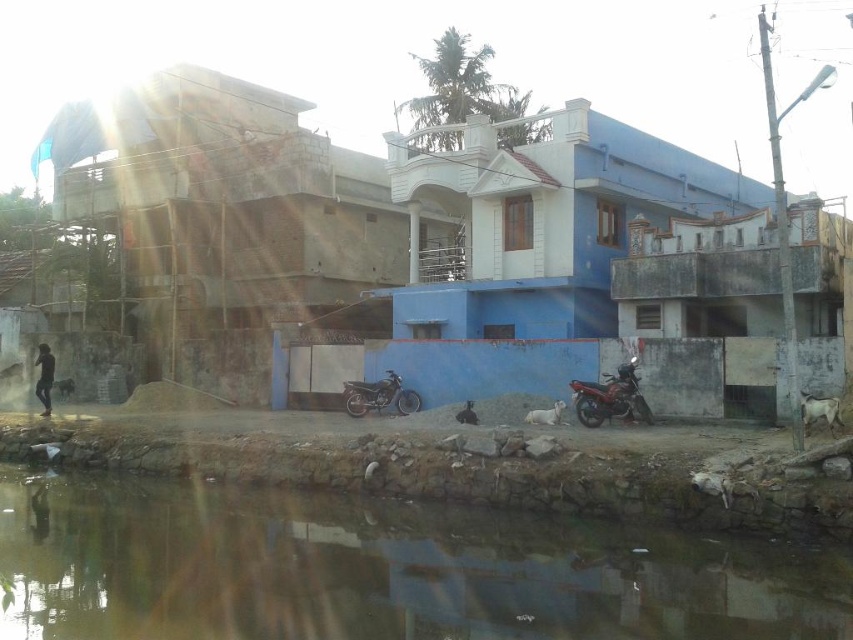
Who is shorter, brown dirt river at lower center or shiny red motorbike at lower right?

Standing shorter between the two is brown dirt river at lower center.

Measure the distance between brown dirt river at lower center and shiny red motorbike at lower right.

5.78 meters

Find the location of a particular element. The width and height of the screenshot is (853, 640). brown dirt river at lower center is located at coordinates (381, 570).

Can you confirm if brown dirt river at lower center is thinner than shiny metallic motorbike at center?

No.

From the picture: Does brown dirt river at lower center appear over shiny metallic motorbike at center?

No.

Find the location of a particular element. Image resolution: width=853 pixels, height=640 pixels. brown dirt river at lower center is located at coordinates (381, 570).

Identify the location of brown dirt river at lower center. (381, 570).

Between point (585, 392) and point (378, 401), which one is positioned in front?

Point (585, 392)

In the scene shown: Does shiny red motorbike at lower right come in front of shiny metallic motorbike at center?

Yes, shiny red motorbike at lower right is in front of shiny metallic motorbike at center.

Who is more distant from viewer, (x=630, y=403) or (x=416, y=392)?

Point (x=416, y=392)

You are a GUI agent. You are given a task and a screenshot of the screen. Output one action in this format:
    pyautogui.click(x=<x>, y=<y>)
    Task: Click on the shiny red motorbike at lower right
    
    Given the screenshot: What is the action you would take?
    pyautogui.click(x=610, y=397)